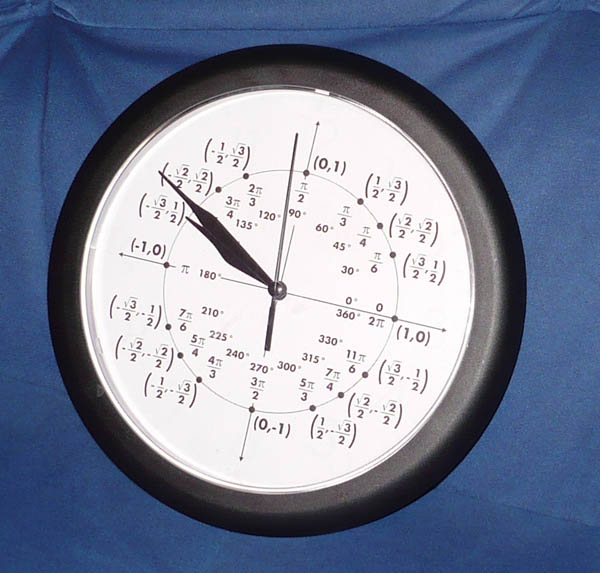
Identify the location of blue cloth. (146, 22).